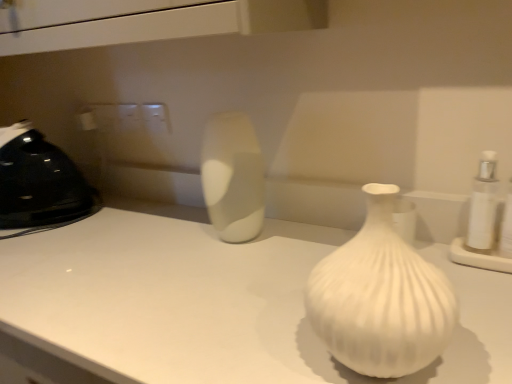
Identify the location of empty space that is in between white ribbed vase at center, the first vase viewed from the front, and satin white vase at center, the first vase from the back. (267, 279).